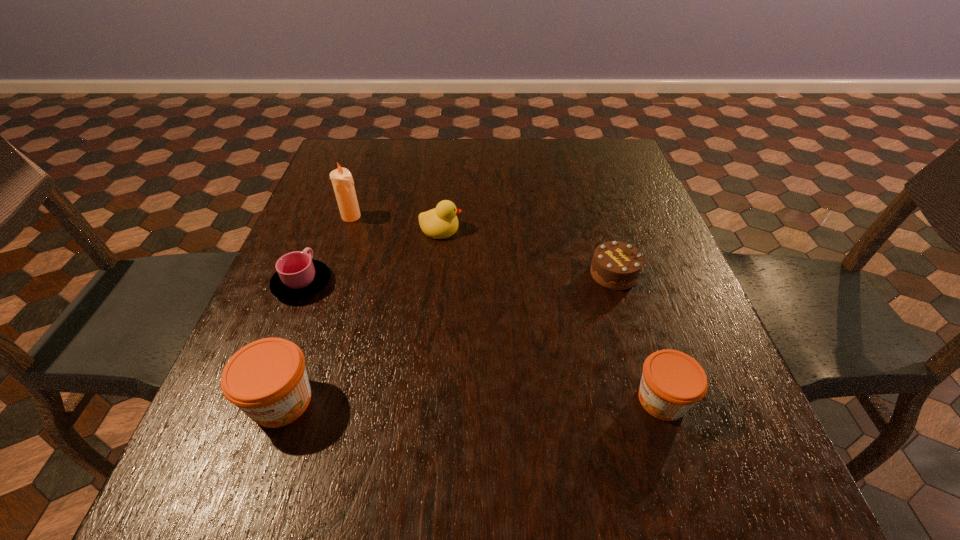
To achieve uniform spacing by inserting another jam among them, please point to a free space for this new jam. Please provide its 2D coordinates. Your answer should be formatted as a tuple, i.e. [(x, y)], where the tuple contains the x and y coordinates of a point satisfying the conditions above.

[(472, 400)]